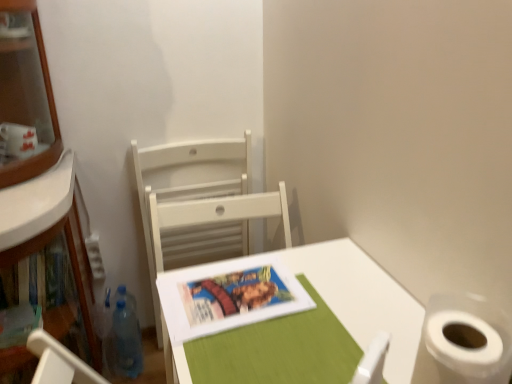
Question: Is white wood chair at center facing away from transparent plastic bottle at lower left?

Choices:
 (A) no
 (B) yes

Answer: (A)

Question: From a real-world perspective, is white wood chair at center physically below transparent plastic bottle at lower left?

Choices:
 (A) no
 (B) yes

Answer: (A)

Question: Is white wood chair at center to the right of transparent plastic bottle at lower left from the viewer's perspective?

Choices:
 (A) no
 (B) yes

Answer: (B)

Question: Is white wood chair at center shorter than transparent plastic bottle at lower left?

Choices:
 (A) yes
 (B) no

Answer: (B)

Question: From a real-world perspective, is white wood chair at center physically above transparent plastic bottle at lower left?

Choices:
 (A) no
 (B) yes

Answer: (B)

Question: From the image's perspective, is white wood chair at center on top of transparent plastic bottle at lower left?

Choices:
 (A) no
 (B) yes

Answer: (B)

Question: From the image's perspective, is matte paper book cover at center over white wood chair at center?

Choices:
 (A) no
 (B) yes

Answer: (A)

Question: Is matte paper book cover at center completely or partially outside of white wood chair at center?

Choices:
 (A) yes
 (B) no

Answer: (A)

Question: Does matte paper book cover at center come behind white wood chair at center?

Choices:
 (A) no
 (B) yes

Answer: (A)

Question: Is matte paper book cover at center positioned with its back to white wood chair at center?

Choices:
 (A) no
 (B) yes

Answer: (A)

Question: Could you tell me if matte paper book cover at center is turned towards white wood chair at center?

Choices:
 (A) yes
 (B) no

Answer: (B)

Question: Does matte paper book cover at center have a greater height compared to white wood chair at center?

Choices:
 (A) yes
 (B) no

Answer: (B)

Question: Is transparent plastic bottle at lower left outside white matte table at center?

Choices:
 (A) no
 (B) yes

Answer: (B)